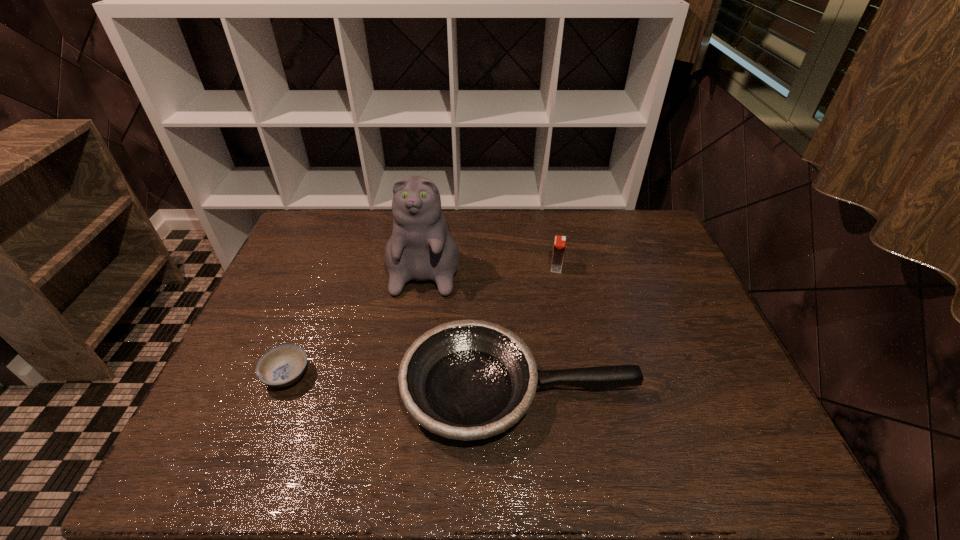
Identify the location of the tallest object. (421, 248).

This screenshot has width=960, height=540. I want to click on orange juice, so click(559, 244).

Locate an element on the screen. The height and width of the screenshot is (540, 960). frying pan is located at coordinates (466, 380).

Locate an element on the screen. bowl is located at coordinates (283, 365).

Identify the location of the leftmost object. (283, 365).

Where is `vacant space positioned on the face of the tallest object`? The width and height of the screenshot is (960, 540). vacant space positioned on the face of the tallest object is located at coordinates (415, 334).

Identify the location of vacant space located 0.400m on the left of the third shortest object. (425, 267).

Find the location of a particular element. This screenshot has height=540, width=960. free spot located on the handle side of the frying pan is located at coordinates (676, 389).

At what (x,y) coordinates should I click in order to perform the action: click on free point located on the right of the shortest object. Please return your answer as a coordinate pair (x, y). Looking at the image, I should click on (339, 375).

Locate an element on the screen. This screenshot has height=540, width=960. object situated at the far edge is located at coordinates (421, 248).